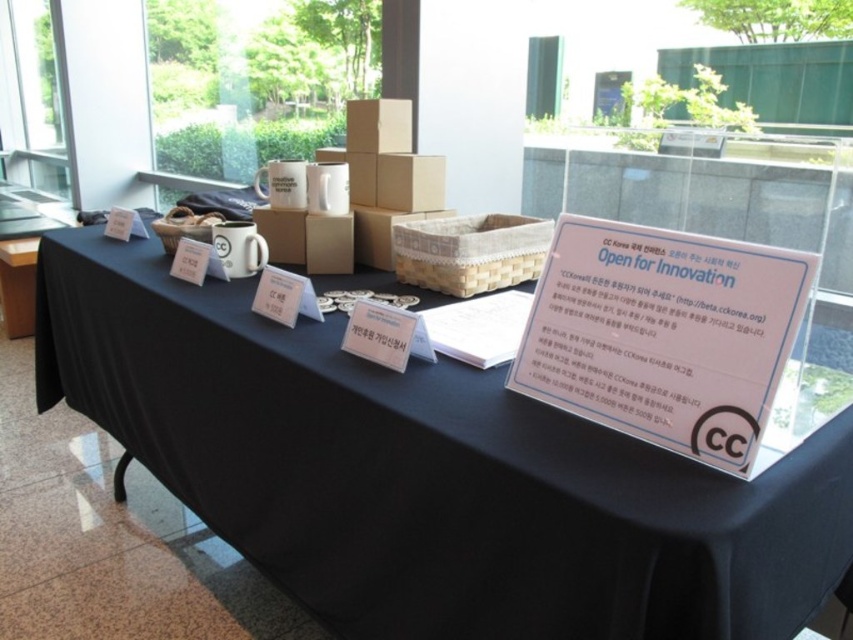
Question: Which point appears farthest from the camera in this image?

Choices:
 (A) (605, 227)
 (B) (285, 540)

Answer: (B)

Question: Can you confirm if black matte tablecloth at center is positioned above white plastic sign at center?

Choices:
 (A) yes
 (B) no

Answer: (B)

Question: Is black matte tablecloth at center behind white plastic sign at center?

Choices:
 (A) yes
 (B) no

Answer: (B)

Question: Which point is closer to the camera taking this photo?

Choices:
 (A) (726, 372)
 (B) (389, 496)

Answer: (A)

Question: Does black matte tablecloth at center have a greater width compared to white plastic sign at center?

Choices:
 (A) no
 (B) yes

Answer: (B)

Question: Among these points, which one is nearest to the camera?

Choices:
 (A) (486, 541)
 (B) (529, 316)

Answer: (A)